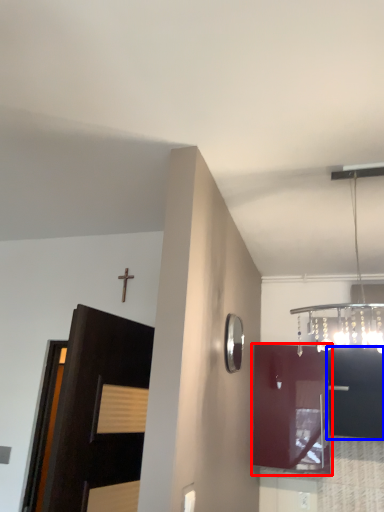
Question: Which of the following is the farthest to the observer, cabinetry (highlighted by a red box) or cabinetry (highlighted by a blue box)?

Choices:
 (A) cabinetry
 (B) cabinetry

Answer: (A)